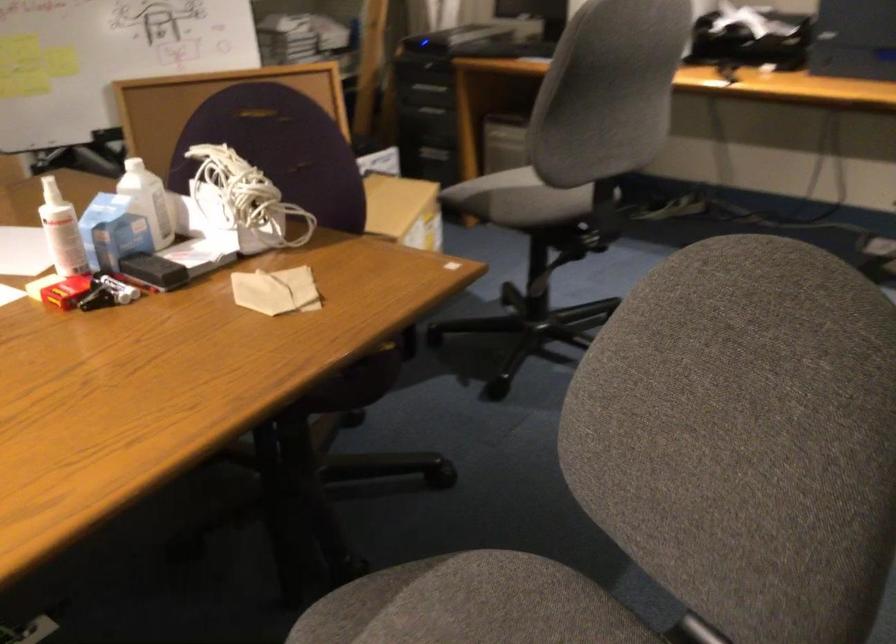
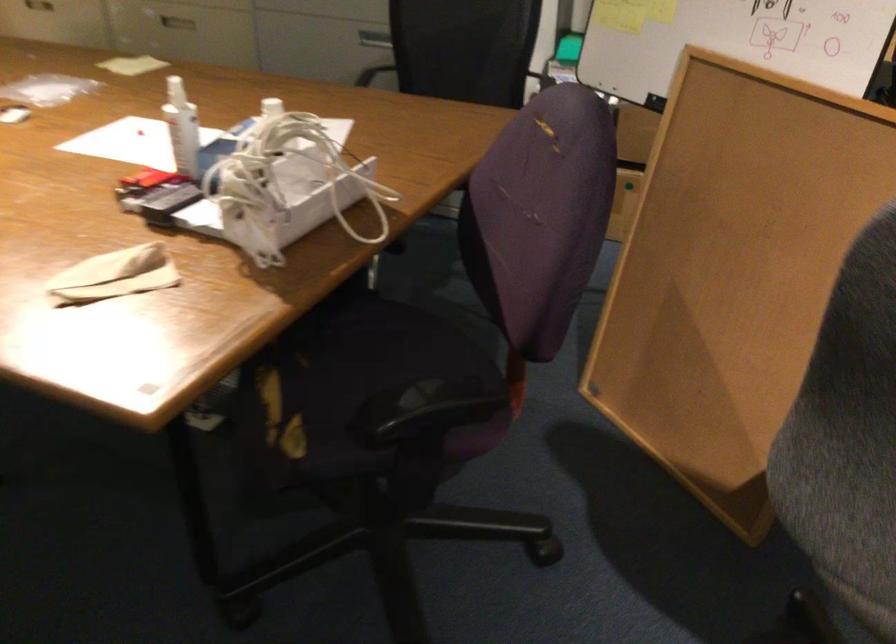
The point at (81, 283) is marked in the first image. Where is the corresponding point in the second image?

(150, 178)